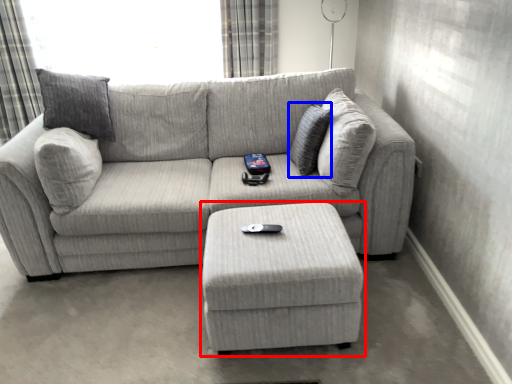
Question: Among these objects, which one is farthest to the camera, table (highlighted by a red box) or pillow (highlighted by a blue box)?

Choices:
 (A) table
 (B) pillow

Answer: (B)